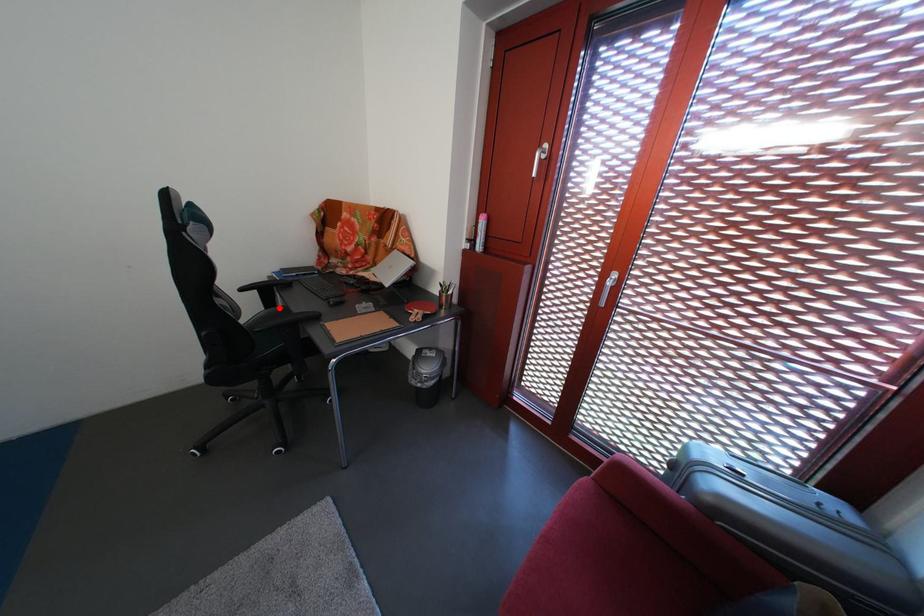
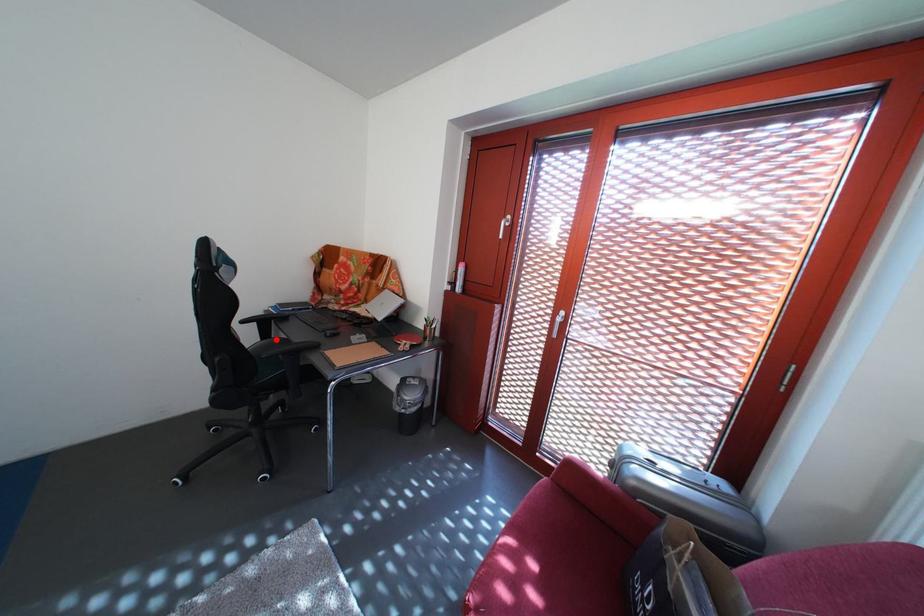
I am providing you with two images of the same scene from different viewpoints. A red point is marked on the first image and another point is marked on the second image. Do the highlighted points in image1 and image2 indicate the same real-world spot?

Yes